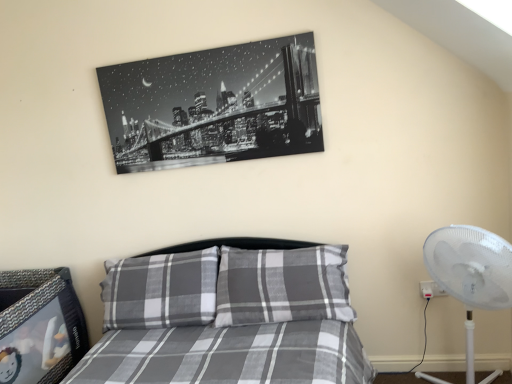
Question: Is white plastic fan at right in front of or behind gray plaid bed at center in the image?

Choices:
 (A) front
 (B) behind

Answer: (B)

Question: Considering the positions of point (425, 377) and point (296, 380), is point (425, 377) closer or farther from the camera than point (296, 380)?

Choices:
 (A) farther
 (B) closer

Answer: (A)

Question: Considering the real-world distances, which object is closest to the white plastic fan at right?

Choices:
 (A) gray plaid bed at center
 (B) black glossy print at upper center

Answer: (A)

Question: Based on their relative distances, which object is farther from the black glossy print at upper center?

Choices:
 (A) white plastic fan at right
 (B) gray plaid bed at center

Answer: (A)